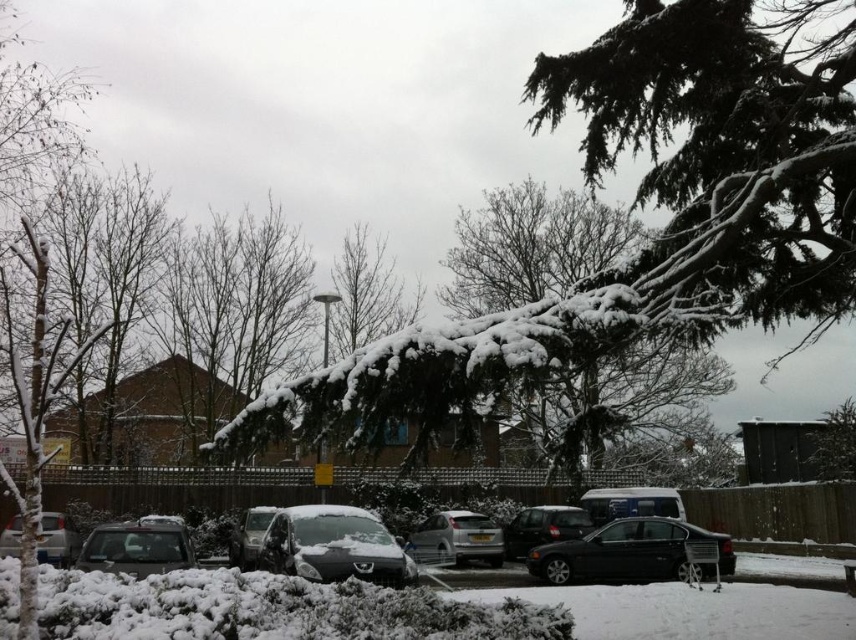
Which is in front, point (455, 552) or point (551, 532)?

Positioned in front is point (551, 532).

This screenshot has width=856, height=640. What do you see at coordinates (456, 540) in the screenshot? I see `satin silver car at center` at bounding box center [456, 540].

You are a GUI agent. You are given a task and a screenshot of the screen. Output one action in this format:
    pyautogui.click(x=<x>, y=<y>)
    Task: Click on the satin silver car at center
    The height and width of the screenshot is (640, 856).
    Given the screenshot: What is the action you would take?
    pyautogui.click(x=456, y=540)

Locate an element on the screen. This screenshot has width=856, height=640. white glossy van at center is located at coordinates (631, 502).

Measure the distance between white glossy van at center and camera.

white glossy van at center and camera are 23.05 meters apart.

Is point (642, 490) closer to camera compared to point (232, 548)?

No, it is behind (232, 548).

Locate an element on the screen. The height and width of the screenshot is (640, 856). white glossy van at center is located at coordinates (631, 502).

Where is `sleek silver sedan at lower left`? The image size is (856, 640). sleek silver sedan at lower left is located at coordinates (137, 547).

At what (x,y) coordinates should I click in order to perform the action: click on sleek silver sedan at lower left. Please return your answer as a coordinate pair (x, y). The image size is (856, 640). Looking at the image, I should click on (137, 547).